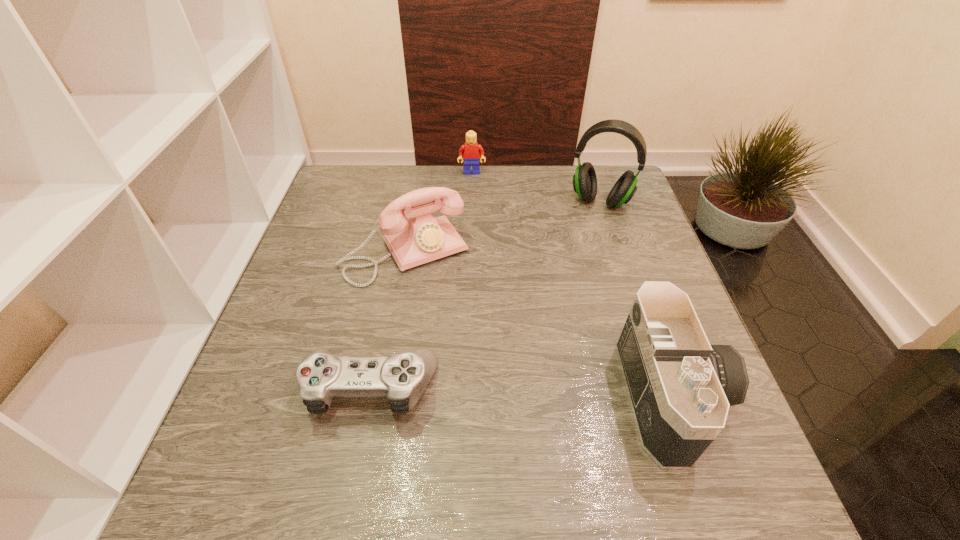
Locate an element on the screen. vacant region located 0.120m on the ear cups of the headset is located at coordinates (583, 240).

In order to click on vacant space situated 0.050m on the dial of the telephone in this screenshot , I will do [439, 298].

You are a GUI agent. You are given a task and a screenshot of the screen. Output one action in this format:
    pyautogui.click(x=<x>, y=<y>)
    Task: Click on the vacant space located 0.220m on the dial of the telephone
    The image size is (960, 540).
    Given the screenshot: What is the action you would take?
    pyautogui.click(x=471, y=353)

Image resolution: width=960 pixels, height=540 pixels. In order to click on vacant point located 0.090m on the dial of the telephone in this screenshot , I will do `click(445, 310)`.

Locate an element on the screen. The image size is (960, 540). vacant region located on the face of the fourth tallest object is located at coordinates (473, 233).

What are the coordinates of `free space located on the face of the fourth tallest object` in the screenshot? It's located at (472, 194).

Image resolution: width=960 pixels, height=540 pixels. In order to click on vacant space located 0.230m on the face of the fourth tallest object in this screenshot , I will do `click(473, 221)`.

Locate an element on the screen. The width and height of the screenshot is (960, 540). headset that is at the far edge is located at coordinates (584, 180).

I want to click on Lego positioned at the far edge, so click(x=471, y=151).

Image resolution: width=960 pixels, height=540 pixels. I want to click on control at the near edge, so click(x=403, y=377).